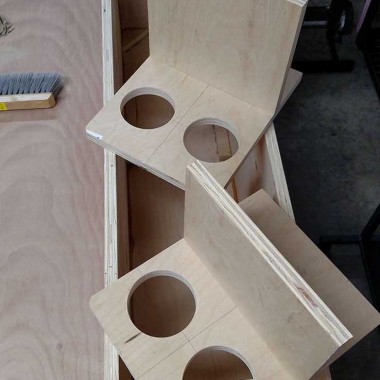
The image size is (380, 380). I want to click on floor, so click(322, 196).